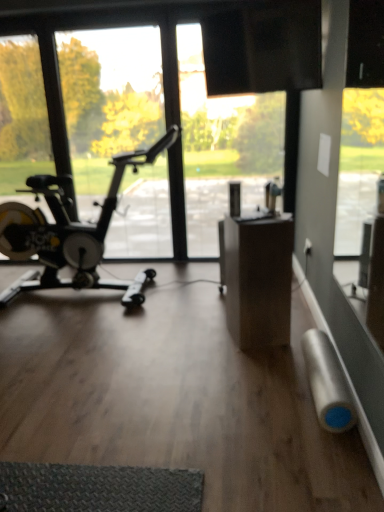
Question: Is transparent glass window at left wider or thinner than black matte stationary bicycle at left?

Choices:
 (A) thin
 (B) wide

Answer: (A)

Question: From the image's perspective, is transparent glass window at left above or below black matte stationary bicycle at left?

Choices:
 (A) above
 (B) below

Answer: (A)

Question: Based on their relative distances, which object is nearer to the black matte stationary bicycle at left?

Choices:
 (A) silver matte duct tape at lower right
 (B) transparent glass window at left

Answer: (A)

Question: Based on their relative distances, which object is farther from the transparent glass window at left?

Choices:
 (A) black matte stationary bicycle at left
 (B) silver matte duct tape at lower right

Answer: (B)